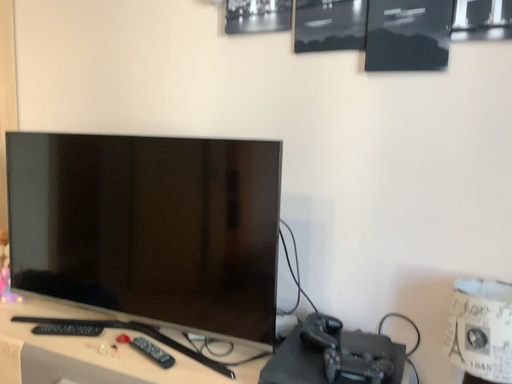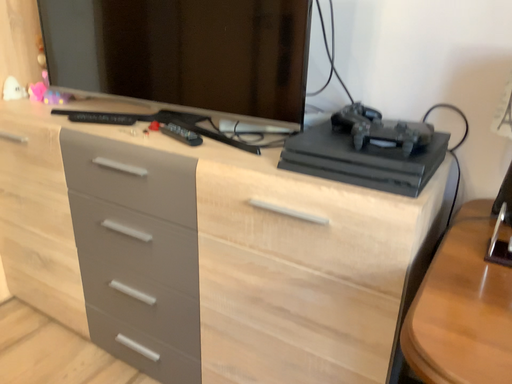
Question: Which way did the camera rotate in the video?

Choices:
 (A) rotated right
 (B) rotated left

Answer: (B)